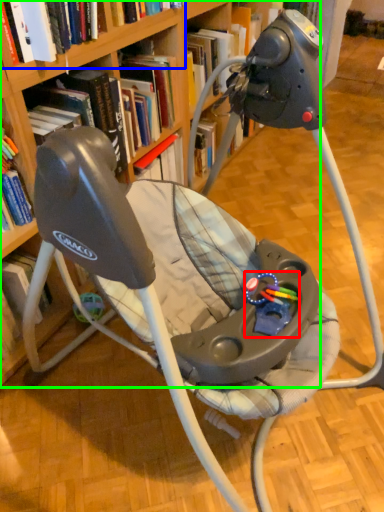
Question: Which is farther away from toy (highlighted by a red box)? book (highlighted by a blue box) or bookcase (highlighted by a green box)?

Choices:
 (A) book
 (B) bookcase

Answer: (A)